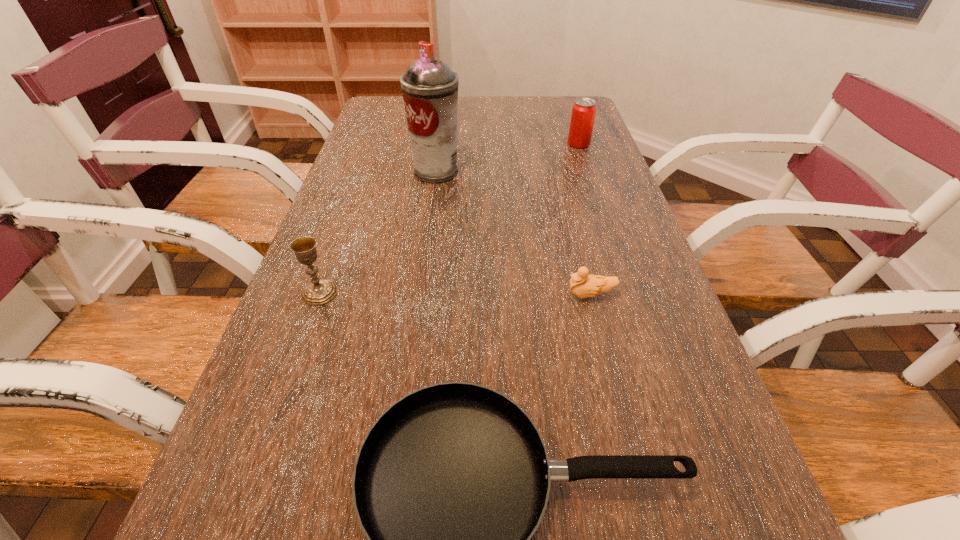
Identify the location of free spot between the can and the tallest object. (508, 158).

I want to click on vacant area that lies between the fourth nearest object and the leftmost object, so click(x=378, y=232).

Image resolution: width=960 pixels, height=540 pixels. I want to click on empty location between the tallest object and the fourth tallest object, so (x=514, y=233).

Locate an element on the screen. vacant space that is in between the farthest object and the leftmost object is located at coordinates (449, 218).

Locate an element on the screen. This screenshot has height=540, width=960. free space between the farthest object and the duckling is located at coordinates (585, 219).

This screenshot has width=960, height=540. I want to click on the second closest object to the duckling, so click(x=430, y=89).

Identify which object is located as the second nearest to the nearest object. Please provide its 2D coordinates. Your answer should be formatted as a tuple, i.e. [(x, y)], where the tuple contains the x and y coordinates of a point satisfying the conditions above.

[(319, 291)]

You are a GUI agent. You are given a task and a screenshot of the screen. Output one action in this format:
    pyautogui.click(x=<x>, y=<y>)
    Task: Click on the vacant space that satisfies the following two spatial constraints: 1. on the front side of the can; 2. on the face of the second shortest object
    
    Given the screenshot: What is the action you would take?
    pyautogui.click(x=630, y=295)